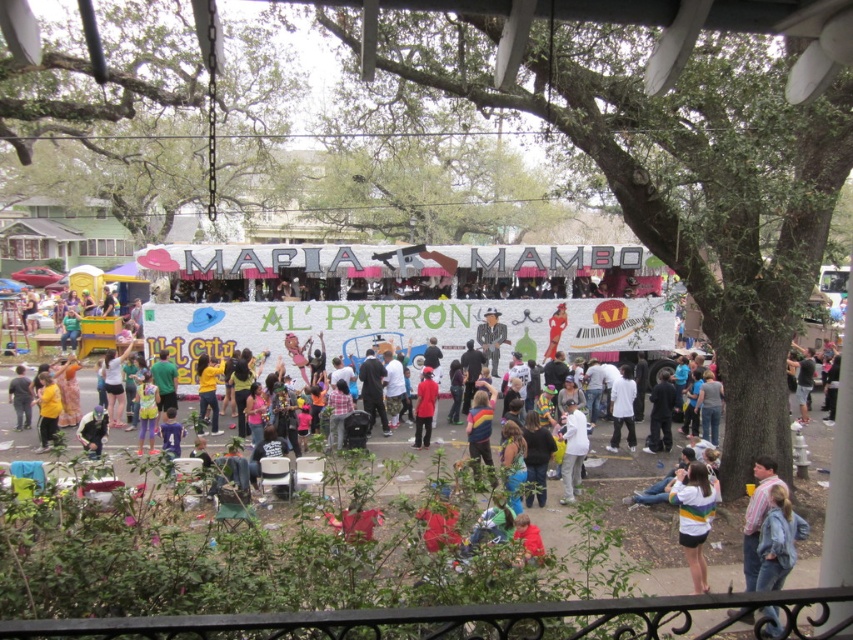
Question: Which object is closer to the camera taking this photo?

Choices:
 (A) white cardboard signboard at center
 (B) white cotton shirt at center
 (C) white cotton shirt at lower right
 (D) white matte coat at center

Answer: (C)

Question: Can you confirm if white cotton shirt at lower right is positioned above white matte coat at center?

Choices:
 (A) no
 (B) yes

Answer: (A)

Question: Estimate the real-world distances between objects in this image. Which object is closer to the matte red coat at center?

Choices:
 (A) white cardboard signboard at center
 (B) white cotton shirt at lower right

Answer: (A)

Question: Can you confirm if white matte coat at center is positioned below matte red coat at center?

Choices:
 (A) yes
 (B) no

Answer: (A)

Question: Does white cardboard signboard at center appear on the left side of white cotton shirt at center?

Choices:
 (A) yes
 (B) no

Answer: (A)

Question: Which point is closer to the camera?

Choices:
 (A) (624, 403)
 (B) (570, 484)
 (C) (190, 248)

Answer: (B)